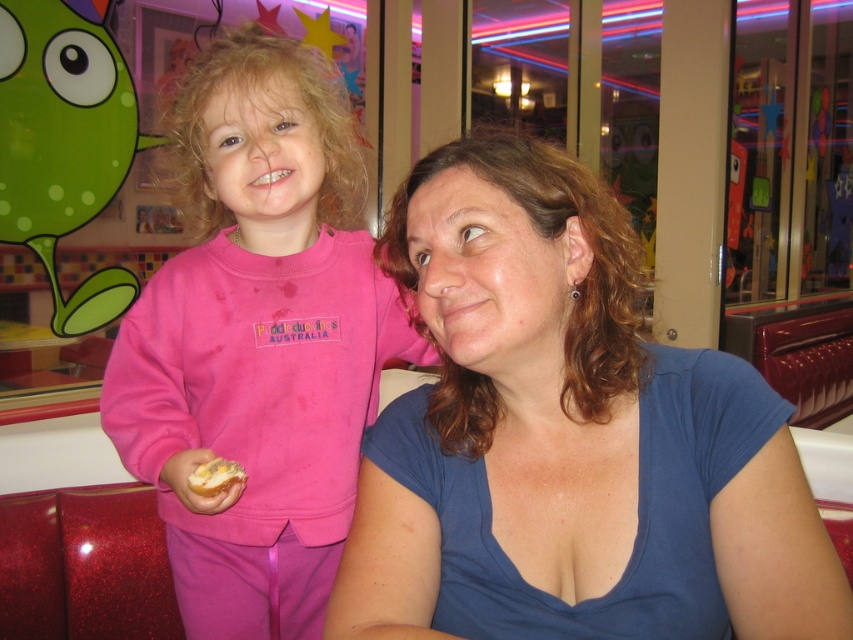
Question: Is blue cotton shirt at center above yellowish bread at lower left?

Choices:
 (A) no
 (B) yes

Answer: (B)

Question: Does blue cotton shirt at center have a larger size compared to pink fleece sweatshirt at left?

Choices:
 (A) yes
 (B) no

Answer: (B)

Question: Which of the following is the closest to the observer?

Choices:
 (A) yellowish bread at lower left
 (B) blue cotton shirt at center
 (C) pink fleece sweatshirt at left

Answer: (B)

Question: Can you confirm if blue cotton shirt at center is positioned above yellowish bread at lower left?

Choices:
 (A) yes
 (B) no

Answer: (A)

Question: Which object appears closest to the camera in this image?

Choices:
 (A) yellowish bread at lower left
 (B) blue cotton shirt at center
 (C) pink fleece sweatshirt at left

Answer: (B)

Question: Which is nearer to the blue cotton shirt at center?

Choices:
 (A) yellowish bread at lower left
 (B) pink fleece sweatshirt at left

Answer: (B)